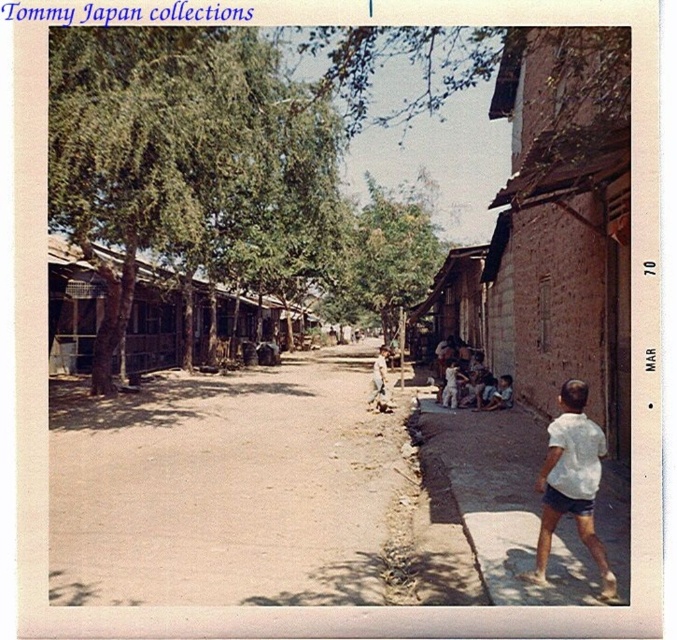
Question: In this image, where is dirt ground at center located relative to light brown wooden stick at center?

Choices:
 (A) left
 (B) right

Answer: (A)

Question: Is dirt ground at center to the right of brown wooden hut at center from the viewer's perspective?

Choices:
 (A) yes
 (B) no

Answer: (A)

Question: Which of these objects is positioned closest to the brown brick hut at right?

Choices:
 (A) brown wooden hut at center-right
 (B) light brown wooden stick at center
 (C) brown wooden hut at center
 (D) dirt ground at center

Answer: (D)

Question: Based on their relative distances, which object is nearer to the brown wooden hut at center-right?

Choices:
 (A) brown brick hut at right
 (B) white matte shirt at lower right

Answer: (A)

Question: Is brown brick hut at right to the left of white matte shirt at lower right from the viewer's perspective?

Choices:
 (A) no
 (B) yes

Answer: (A)

Question: Which of the following is the farthest from the observer?

Choices:
 (A) (607, 564)
 (B) (492, 563)
 (C) (376, 406)
 (D) (219, 358)

Answer: (D)